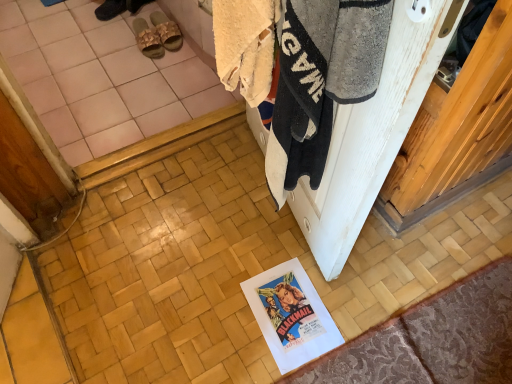
You are a GUI agent. You are given a task and a screenshot of the screen. Output one action in this format:
    pyautogui.click(x=<x>, y=<y>)
    Task: Click on the free space that is to the left of dark brown leather sandals at upper center, which is the 1th footwear in left-to-right order
    
    Given the screenshot: What is the action you would take?
    pyautogui.click(x=77, y=12)